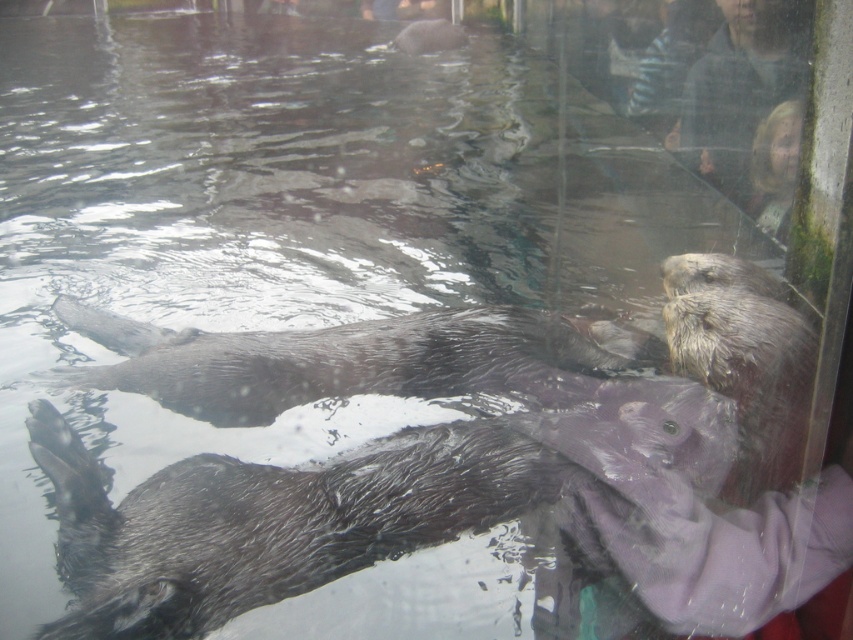
Does wet fur otter at lower left lie in front of shiny brown otter at center?

Yes, wet fur otter at lower left is closer to the viewer.

Which is in front, point (488, 444) or point (463, 392)?

Point (488, 444) is in front.

Find the location of a particular element. Image resolution: width=853 pixels, height=640 pixels. wet fur otter at lower left is located at coordinates (271, 520).